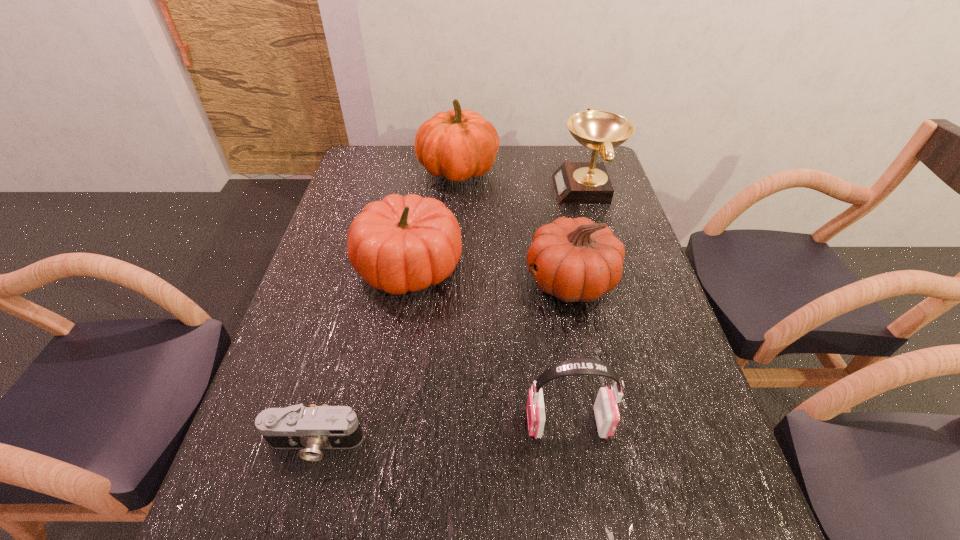
The height and width of the screenshot is (540, 960). I want to click on free space between the rightmost pumpkin and the earphone, so click(x=569, y=352).

You are a GUI agent. You are given a task and a screenshot of the screen. Output one action in this format:
    pyautogui.click(x=<x>, y=<y>)
    Task: Click on the vacant area that lies between the earphone and the rightmost pumpkin
    
    Given the screenshot: What is the action you would take?
    coord(569,352)

What are the coordinates of `free space between the shortest object and the award` in the screenshot? It's located at (450, 316).

I want to click on free space between the shortest object and the farthest pumpkin, so click(x=387, y=307).

Locate an element on the screen. The image size is (960, 540). vacant area between the earphone and the farthest pumpkin is located at coordinates (513, 298).

Image resolution: width=960 pixels, height=540 pixels. In order to click on object that stands as the fifth closest to the tallest pumpkin in this screenshot , I will do `click(313, 428)`.

Identify which object is located as the fifth nearest to the tallest pumpkin. Please provide its 2D coordinates. Your answer should be formatted as a tuple, i.e. [(x, y)], where the tuple contains the x and y coordinates of a point satisfying the conditions above.

[(313, 428)]

Locate which pumpkin ranks in proximity to the earphone. Please provide its 2D coordinates. Your answer should be formatted as a tuple, i.e. [(x, y)], where the tuple contains the x and y coordinates of a point satisfying the conditions above.

[(579, 260)]

Where is `pumpkin that can be found as the closest to the earphone`? The height and width of the screenshot is (540, 960). pumpkin that can be found as the closest to the earphone is located at coordinates (579, 260).

This screenshot has height=540, width=960. I want to click on blank space that satisfies the following two spatial constraints: 1. on the face of the rightmost pumpkin; 2. on the lens of the shortest object, so click(x=604, y=443).